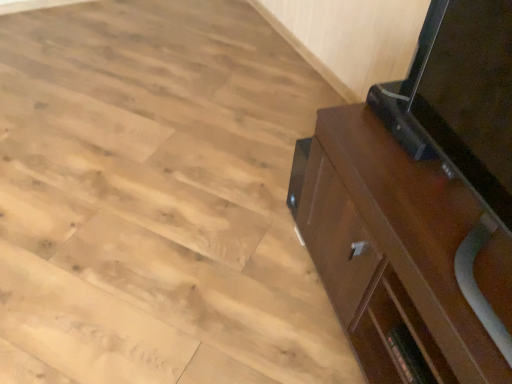
Locate an element on the screen. This screenshot has width=512, height=384. empty space that is ontop of natural wood floor at lower right is located at coordinates (182, 192).